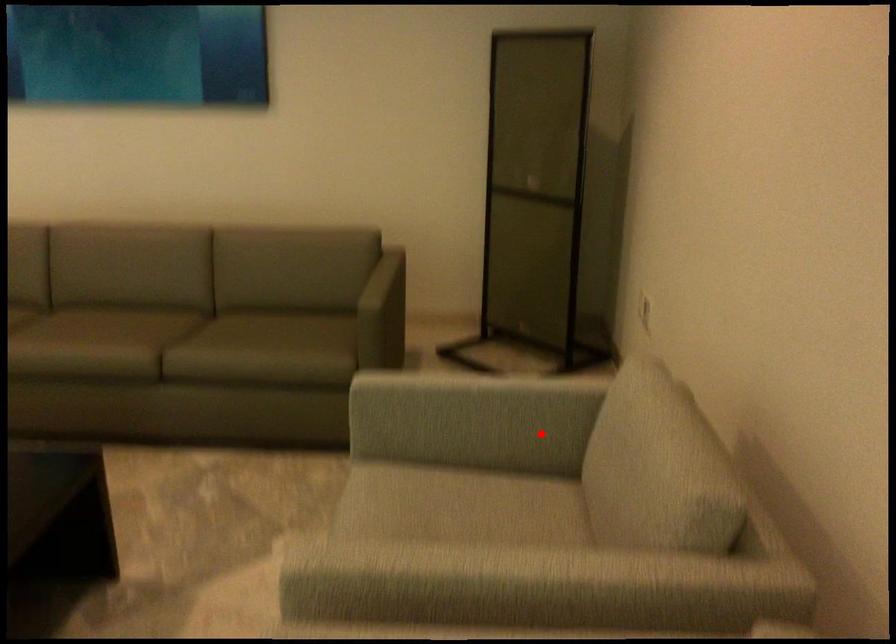
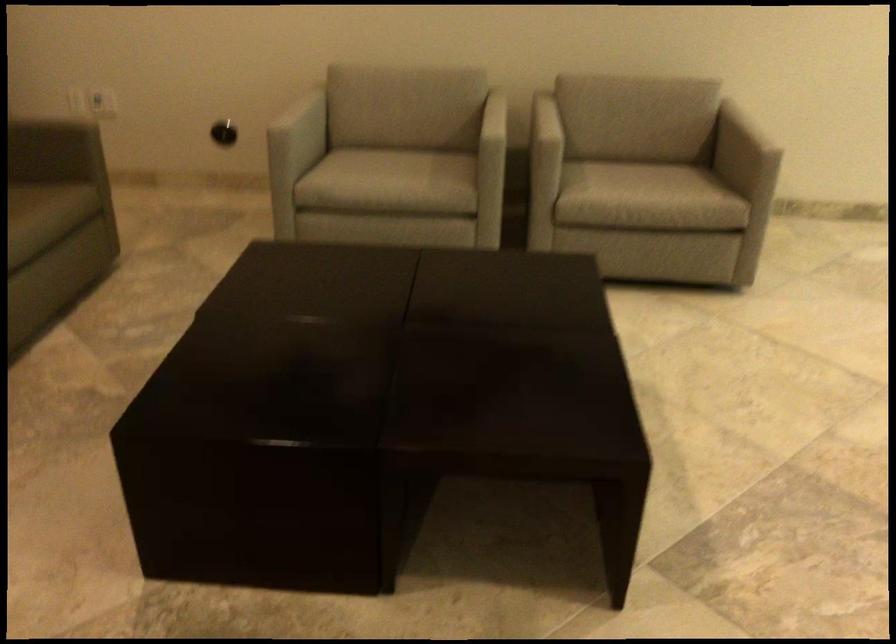
Where in the second image is the point corresponding to the highlighted location from the first image?

(304, 124)